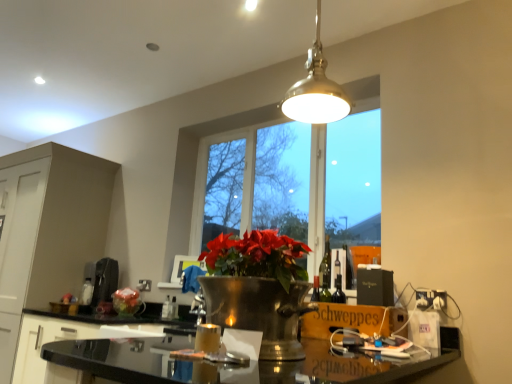
Question: Considering the positions of black glossy countertop at center and black glossy countertop at lower center, acting as the second cabinetry starting from the left, in the image, is black glossy countertop at center wider or thinner than black glossy countertop at lower center, acting as the second cabinetry starting from the left,?

Choices:
 (A) thin
 (B) wide

Answer: (B)

Question: Is point (373, 360) positioned closer to the camera than point (75, 329)?

Choices:
 (A) closer
 (B) farther

Answer: (A)

Question: Which of these objects is positioned closest to the matte white cabinet at left, marked as the first cabinetry in a left-to-right arrangement?

Choices:
 (A) black glossy countertop at lower center, which ranks as the first cabinetry in right-to-left order
 (B) wooden schweppes box at lower right
 (C) metallic silver flower at center
 (D) black matte coffee machine at left
 (E) metallic pendant light at upper center

Answer: (D)

Question: Which of these objects is positioned farthest from the translucent glass bottle at center, the second bottle in the left-to-right sequence?

Choices:
 (A) matte white cabinet at left, marked as the first cabinetry in a left-to-right arrangement
 (B) white plastic electric outlet at lower right
 (C) black glossy countertop at center
 (D) metallic silver flower at center
 (E) translucent glass bottle at center, which ranks as the 1th bottle in left-to-right order

Answer: (B)